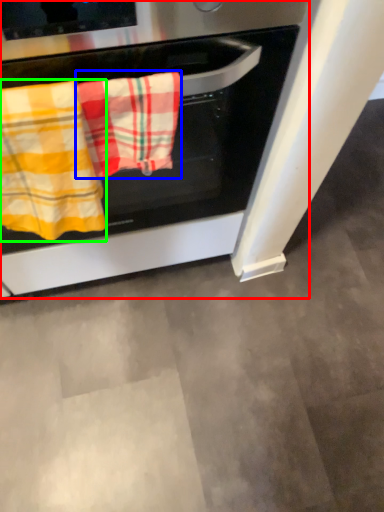
Question: Which object is the closest to the oven (highlighted by a red box)? Choose among these: beach towel (highlighted by a blue box) or beach towel (highlighted by a green box).

Choices:
 (A) beach towel
 (B) beach towel

Answer: (A)